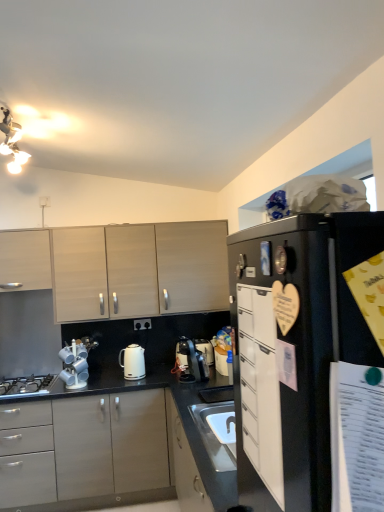
Question: Is black matte refrigerator at upper right at the left side of metallic silver cup rack at lower left?

Choices:
 (A) yes
 (B) no

Answer: (B)

Question: Is black matte refrigerator at upper right taller than metallic silver cup rack at lower left?

Choices:
 (A) yes
 (B) no

Answer: (A)

Question: From a real-world perspective, is black matte refrigerator at upper right located beneath metallic silver cup rack at lower left?

Choices:
 (A) yes
 (B) no

Answer: (B)

Question: Does black matte refrigerator at upper right have a larger size compared to metallic silver cup rack at lower left?

Choices:
 (A) yes
 (B) no

Answer: (A)

Question: Can you see black matte refrigerator at upper right touching metallic silver cup rack at lower left?

Choices:
 (A) yes
 (B) no

Answer: (B)

Question: From a real-world perspective, relative to satin black coffee machine at center, is matte gray cabinets at center, which appears as the 3th cabinetry when viewed from the back, vertically above or below?

Choices:
 (A) above
 (B) below

Answer: (B)

Question: Is point (18, 411) positioned closer to the camera than point (195, 352)?

Choices:
 (A) farther
 (B) closer

Answer: (B)

Question: From the image's perspective, is matte gray cabinets at center, which appears as the 3th cabinetry when viewed from the back, above or below satin black coffee machine at center?

Choices:
 (A) above
 (B) below

Answer: (B)

Question: Choose the correct answer: Is matte gray cabinets at center, the second cabinetry in the front-to-back sequence, inside satin black coffee machine at center or outside it?

Choices:
 (A) outside
 (B) inside

Answer: (A)

Question: Considering the positions of white glossy kettle at center and light wood/veneer cabinets at upper left, which ranks as the 4th cabinetry in front-to-back order, in the image, is white glossy kettle at center bigger or smaller than light wood/veneer cabinets at upper left, which ranks as the 4th cabinetry in front-to-back order,?

Choices:
 (A) big
 (B) small

Answer: (B)

Question: From a real-world perspective, relative to light wood/veneer cabinets at upper left, the 1th cabinetry in the back-to-front sequence, is white glossy kettle at center vertically above or below?

Choices:
 (A) above
 (B) below

Answer: (B)

Question: Choose the correct answer: Is white glossy kettle at center inside light wood/veneer cabinets at upper left, the 1th cabinetry in the back-to-front sequence, or outside it?

Choices:
 (A) inside
 (B) outside

Answer: (B)

Question: Considering the positions of white glossy kettle at center and light wood/veneer cabinets at upper left, which ranks as the 4th cabinetry in front-to-back order, in the image, is white glossy kettle at center wider or thinner than light wood/veneer cabinets at upper left, which ranks as the 4th cabinetry in front-to-back order,?

Choices:
 (A) thin
 (B) wide

Answer: (A)

Question: Considering the positions of light wood/veneer cabinets at upper left, which ranks as the 4th cabinetry in front-to-back order, and white glossy kettle at center in the image, is light wood/veneer cabinets at upper left, which ranks as the 4th cabinetry in front-to-back order, bigger or smaller than white glossy kettle at center?

Choices:
 (A) small
 (B) big

Answer: (B)

Question: Considering their positions, is light wood/veneer cabinets at upper left, the 1th cabinetry in the back-to-front sequence, located in front of or behind white glossy kettle at center?

Choices:
 (A) front
 (B) behind

Answer: (B)